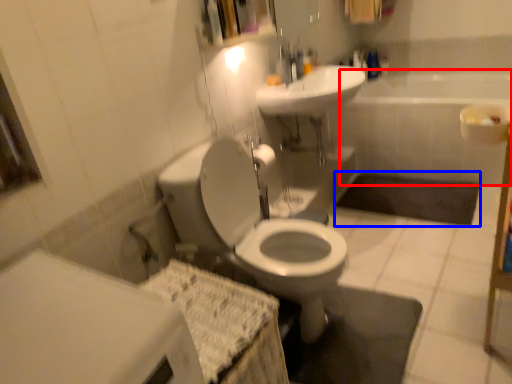
Question: Which of the following is the closest to the observer, bath (highlighted by a red box) or bath mat (highlighted by a blue box)?

Choices:
 (A) bath
 (B) bath mat

Answer: (B)